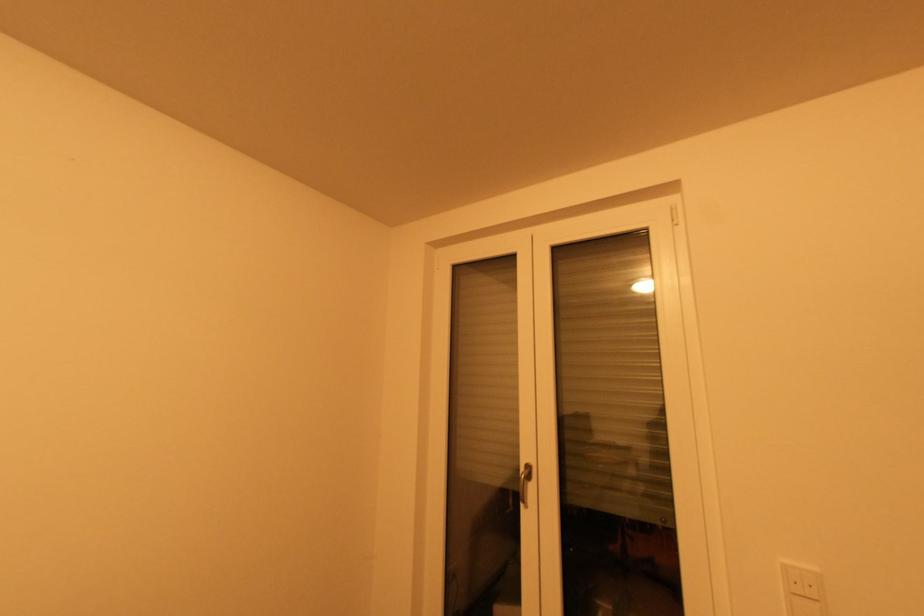
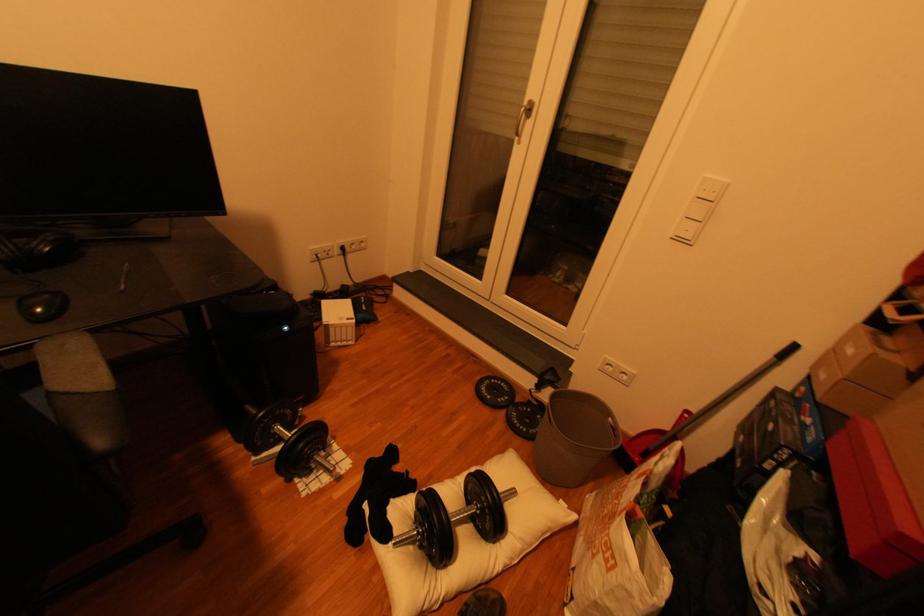
Locate, in the second image, the point that corresponds to the point at 529,469 in the first image.

(533, 100)